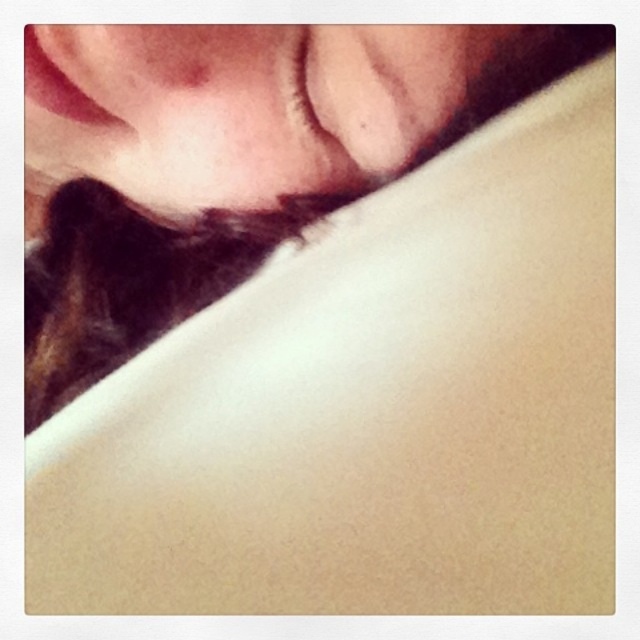
Question: Which of the following is the farthest from the observer?

Choices:
 (A) (205, 275)
 (B) (230, 76)

Answer: (A)

Question: Is smooth skin at center positioned behind matte skin at upper center?

Choices:
 (A) yes
 (B) no

Answer: (B)

Question: Which point is farther to the camera?

Choices:
 (A) smooth skin at center
 (B) matte skin at upper center

Answer: (B)

Question: Which of the following is the closest to the observer?

Choices:
 (A) matte skin at upper center
 (B) smooth skin at center

Answer: (B)

Question: Is smooth skin at center thinner than matte skin at upper center?

Choices:
 (A) no
 (B) yes

Answer: (B)

Question: Is smooth skin at center below matte skin at upper center?

Choices:
 (A) no
 (B) yes

Answer: (A)